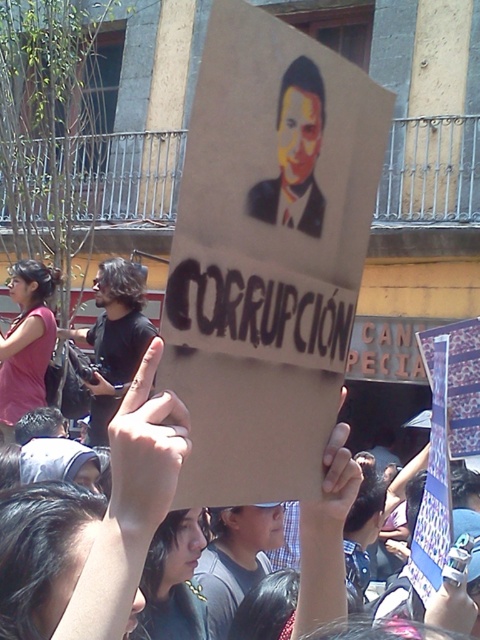
The image size is (480, 640). Describe the element at coordinates (295, 154) in the screenshot. I see `yellow painted face at center` at that location.

Which is behind, point (297, 157) or point (36, 312)?

Positioned behind is point (36, 312).

From the picture: Measure the distance between point (291, 164) and camera.

Point (291, 164) is 13.91 meters away from camera.

Locate an element on the screen. The width and height of the screenshot is (480, 640). yellow painted face at center is located at coordinates (295, 154).

Is black t-shirt at center below matte pink shirt at left?

Correct, black t-shirt at center is located below matte pink shirt at left.

Between point (95, 276) and point (56, 330), which one is positioned behind?

The point (95, 276) is behind.

Find the location of `black t-shirt at center`. black t-shirt at center is located at coordinates (113, 340).

Can you confirm if yellow painted face at center is bigger than black t-shirt at center?

No, yellow painted face at center is not bigger than black t-shirt at center.

Is yellow painted face at center above black t-shirt at center?

→ Yes, yellow painted face at center is above black t-shirt at center.

Locate an element on the screen. This screenshot has width=480, height=640. yellow painted face at center is located at coordinates (295, 154).